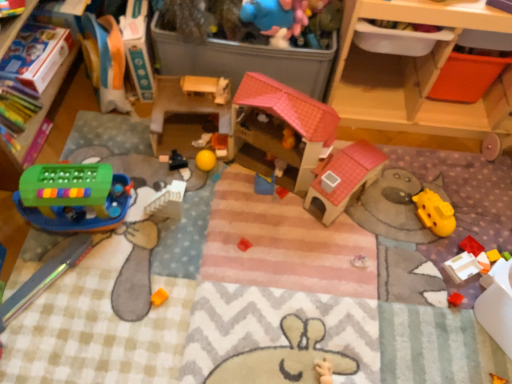
Locate an element on the screen. The height and width of the screenshot is (384, 512). vacant region to the left of bright red plastic block at lower right, the ninth toy positioned from the left is located at coordinates (417, 246).